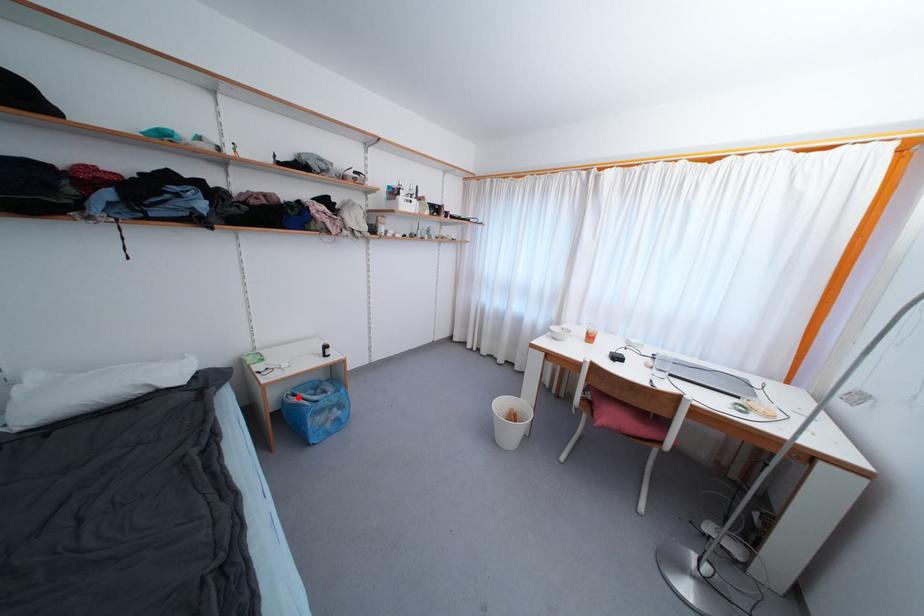
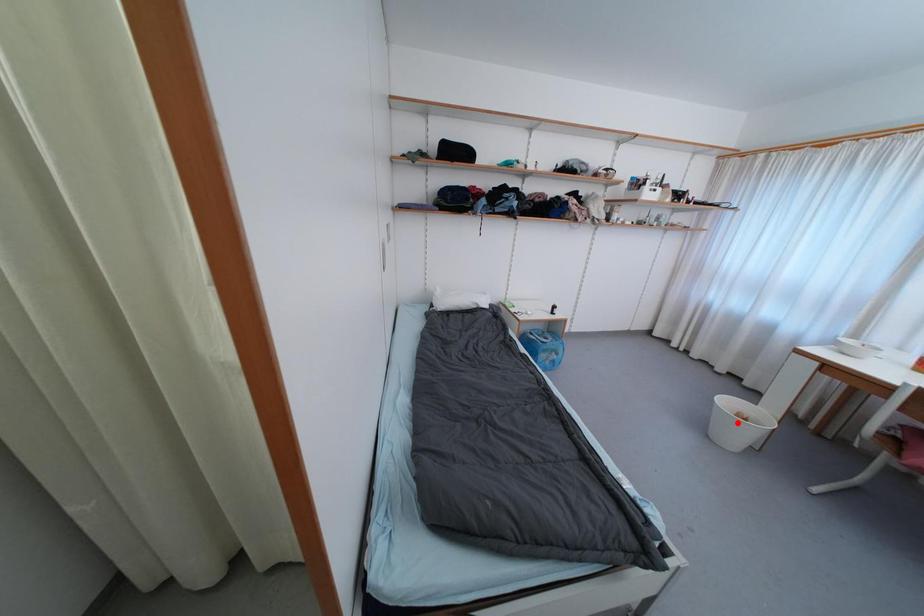
I am providing you with two images of the same scene from different viewpoints. A red point is marked on the first image and another point is marked on the second image. Do the highlighted points in image1 and image2 indicate the same real-world spot?

No